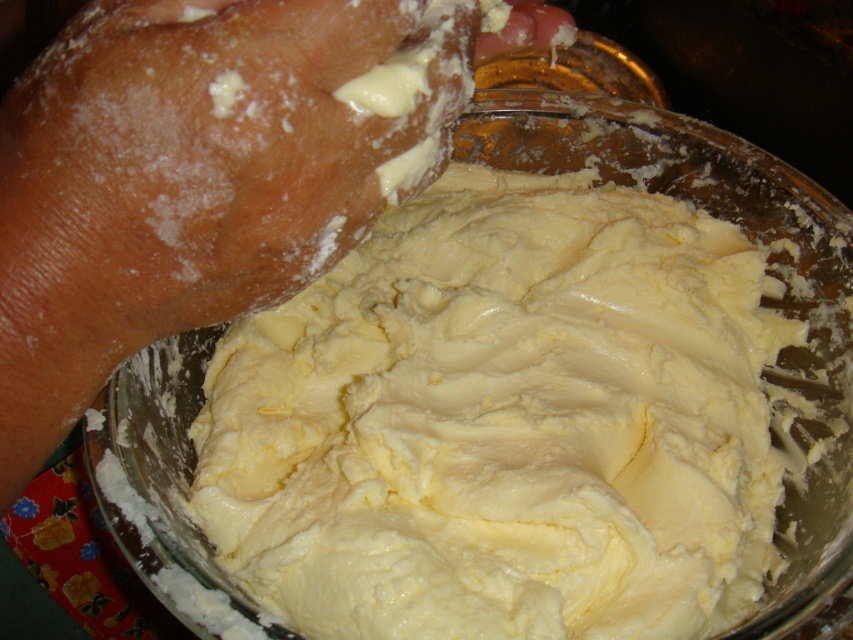
Question: Which point is closer to the camera taking this photo?

Choices:
 (A) (547, 451)
 (B) (560, 33)

Answer: (B)

Question: Which of the following is the closest to the observer?

Choices:
 (A) yellow creamy dough at center
 (B) flesh-toned skin at upper center

Answer: (B)

Question: Does yellow creamy dough at center appear on the left side of flesh-toned skin at upper center?

Choices:
 (A) yes
 (B) no

Answer: (B)

Question: Is yellow creamy dough at center bigger than flesh-toned skin at upper center?

Choices:
 (A) no
 (B) yes

Answer: (B)

Question: Which point is farther from the camera taking this photo?

Choices:
 (A) (241, 500)
 (B) (518, 35)

Answer: (A)

Question: Where is yellow creamy dough at center located in relation to flesh-toned skin at upper center in the image?

Choices:
 (A) above
 (B) below

Answer: (B)